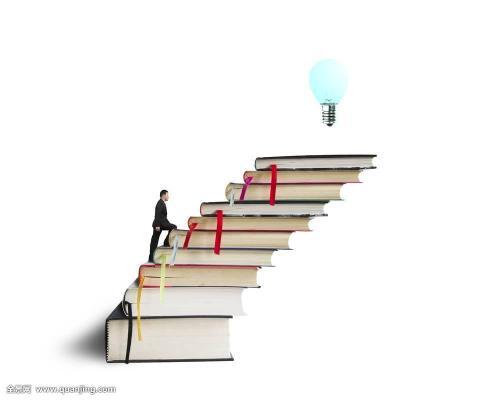
Where is `book`? Image resolution: width=500 pixels, height=400 pixels. book is located at coordinates (182, 346), (200, 296), (204, 277), (204, 254), (256, 238), (265, 222), (287, 208), (301, 192), (310, 174), (314, 160).